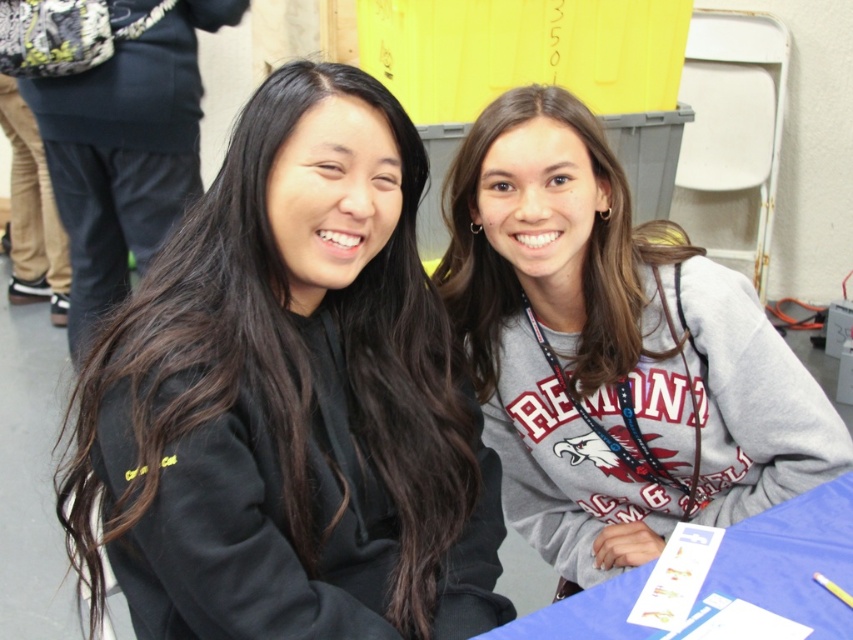
Consider the image. Based on the scene description, where is the gray sweatshirt at center located in terms of its 2D coordinates?

The gray sweatshirt at center is located at the 2D coordinates of point (x=613, y=349).

You are a photographer trying to capture a closeup of the black matte sweatshirt at center and the black matte hair at upper left. Which object should you focus on first if you want to ensure both are in focus without moving the camera?

The black matte hair at upper left is located above the black matte sweatshirt at center, so you should focus on the black matte hair at upper left first to ensure both are in focus since it is farther away from the camera.